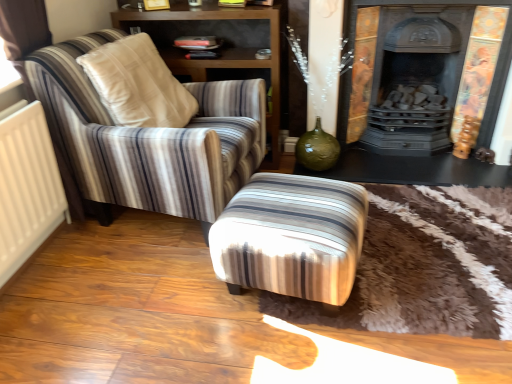
This screenshot has width=512, height=384. Describe the element at coordinates (220, 48) in the screenshot. I see `wooden shelf at upper left` at that location.

Describe the element at coordinates (150, 139) in the screenshot. I see `striped fabric armchair at left` at that location.

What do you see at coordinates (412, 170) in the screenshot? I see `black glossy table at lower right` at bounding box center [412, 170].

This screenshot has height=384, width=512. What do you see at coordinates (291, 237) in the screenshot? I see `striped fabric ottoman at center` at bounding box center [291, 237].

Find the location of a particular element. This screenshot has height=384, width=512. wooden shelf at upper left is located at coordinates (220, 48).

Considering the sizes of objects wooden shelf at upper left and black glossy table at lower right in the image provided, who is shorter, wooden shelf at upper left or black glossy table at lower right?

Standing shorter between the two is black glossy table at lower right.

Between wooden shelf at upper left and black glossy table at lower right, which one has larger width?

black glossy table at lower right.

Considering the relative sizes of wooden shelf at upper left and black glossy table at lower right in the image provided, is wooden shelf at upper left bigger than black glossy table at lower right?

Yes.

Is wooden shelf at upper left in front of or behind black glossy table at lower right in the image?

Clearly, wooden shelf at upper left is in front of black glossy table at lower right.

Considering the positions of objects white matte radiator at left and dark gray cast iron fireplace at upper right in the image provided, who is behind, white matte radiator at left or dark gray cast iron fireplace at upper right?

dark gray cast iron fireplace at upper right.

Who is smaller, white matte radiator at left or dark gray cast iron fireplace at upper right?

white matte radiator at left is smaller.

At what (x,y) coordinates should I click in order to perform the action: click on radiator that appears below the dark gray cast iron fireplace at upper right (from a real-world perspective). Please return your answer as a coordinate pair (x, y). The image size is (512, 384). Looking at the image, I should click on (27, 186).

Which is in front, white matte radiator at left or striped fabric armchair at left?

white matte radiator at left is in front.

Is point (42, 110) closer or farther from the camera than point (85, 53)?

Point (42, 110) appears to be closer to the viewer than point (85, 53).

Is striped fabric armchair at left at the back of white matte radiator at left?

No, white matte radiator at left's orientation is not away from striped fabric armchair at left.

In the scene shown: Is white matte radiator at left looking in the opposite direction of black glossy table at lower right?

white matte radiator at left is not turned away from black glossy table at lower right.

Are white matte radiator at left and black glossy table at lower right making contact?

No, white matte radiator at left is not making contact with black glossy table at lower right.

Locate an element on the screen. This screenshot has width=512, height=384. table on the right of the white matte radiator at left is located at coordinates (412, 170).

Between point (438, 161) and point (357, 177), which one is positioned behind?

Positioned behind is point (438, 161).

How far apart are black glossy table at lower right and dark gray cast iron fireplace at upper right?

3.56 inches.

Considering the positions of objects black glossy table at lower right and dark gray cast iron fireplace at upper right in the image provided, who is in front, black glossy table at lower right or dark gray cast iron fireplace at upper right?

dark gray cast iron fireplace at upper right is closer to the camera.

How different are the orientations of wooden shelf at upper left and striped fabric ottoman at center in degrees?

→ The angle between the facing direction of wooden shelf at upper left and the facing direction of striped fabric ottoman at center is 79.9 degrees.

Considering the positions of objects wooden shelf at upper left and striped fabric ottoman at center in the image provided, who is more to the left, wooden shelf at upper left or striped fabric ottoman at center?

Positioned to the left is wooden shelf at upper left.

Would you consider wooden shelf at upper left to be distant from striped fabric ottoman at center?

Yes, wooden shelf at upper left and striped fabric ottoman at center are located far from each other.

Consider the image. From a real-world perspective, between wooden shelf at upper left and striped fabric ottoman at center, who is vertically lower?

In real-world perspective, striped fabric ottoman at center is lower.

Which is more to the left, striped fabric ottoman at center or dark gray cast iron fireplace at upper right?

striped fabric ottoman at center.

From the picture: Which is less distant, (237, 215) or (426, 167)?

Point (237, 215).

From the image's perspective, who appears lower, striped fabric ottoman at center or dark gray cast iron fireplace at upper right?

striped fabric ottoman at center is shown below in the image.

Locate an element on the screen. Image resolution: width=512 pixels, height=384 pixels. table behind the wooden shelf at upper left is located at coordinates (412, 170).

Find the location of `fireplace that appears on the right of white matte radiator at left`. fireplace that appears on the right of white matte radiator at left is located at coordinates (412, 169).

Considering their positions, is white matte radiator at left positioned closer to striped fabric armchair at left than wooden shelf at upper left?

white matte radiator at left.

Looking at the image, which one is located further to dark gray cast iron fireplace at upper right, black glossy table at lower right or striped fabric armchair at left?

Among the two, striped fabric armchair at left is located further to dark gray cast iron fireplace at upper right.

When comparing their distances from striped fabric armchair at left, does white matte radiator at left or dark gray cast iron fireplace at upper right seem closer?

white matte radiator at left is positioned closer to the anchor striped fabric armchair at left.

From the image, which object appears to be farther from striped fabric ottoman at center, wooden shelf at upper left or dark gray cast iron fireplace at upper right?

Based on the image, wooden shelf at upper left appears to be further to striped fabric ottoman at center.

Which object lies further to the anchor point striped fabric armchair at left, black glossy table at lower right or white matte radiator at left?

black glossy table at lower right is further to striped fabric armchair at left.

When comparing their distances from wooden shelf at upper left, does white matte radiator at left or dark gray cast iron fireplace at upper right seem closer?

Among the two, dark gray cast iron fireplace at upper right is located nearer to wooden shelf at upper left.

Looking at the image, which one is located further to striped fabric ottoman at center, black glossy table at lower right or white matte radiator at left?

white matte radiator at left is further to striped fabric ottoman at center.

From the image, which object appears to be nearer to black glossy table at lower right, striped fabric ottoman at center or dark gray cast iron fireplace at upper right?

dark gray cast iron fireplace at upper right lies closer to black glossy table at lower right than the other object.

Where is `stool located between wooden shelf at upper left and dark gray cast iron fireplace at upper right in the left-right direction`? This screenshot has width=512, height=384. stool located between wooden shelf at upper left and dark gray cast iron fireplace at upper right in the left-right direction is located at coordinates (291, 237).

Find the location of a particular element. Image resolution: width=512 pixels, height=384 pixels. shelf between white matte radiator at left and black glossy table at lower right is located at coordinates (220, 48).

Where is `table situated between white matte radiator at left and dark gray cast iron fireplace at upper right from left to right`? Image resolution: width=512 pixels, height=384 pixels. table situated between white matte radiator at left and dark gray cast iron fireplace at upper right from left to right is located at coordinates (412, 170).

I want to click on shelf located between white matte radiator at left and striped fabric ottoman at center in the left-right direction, so click(x=220, y=48).